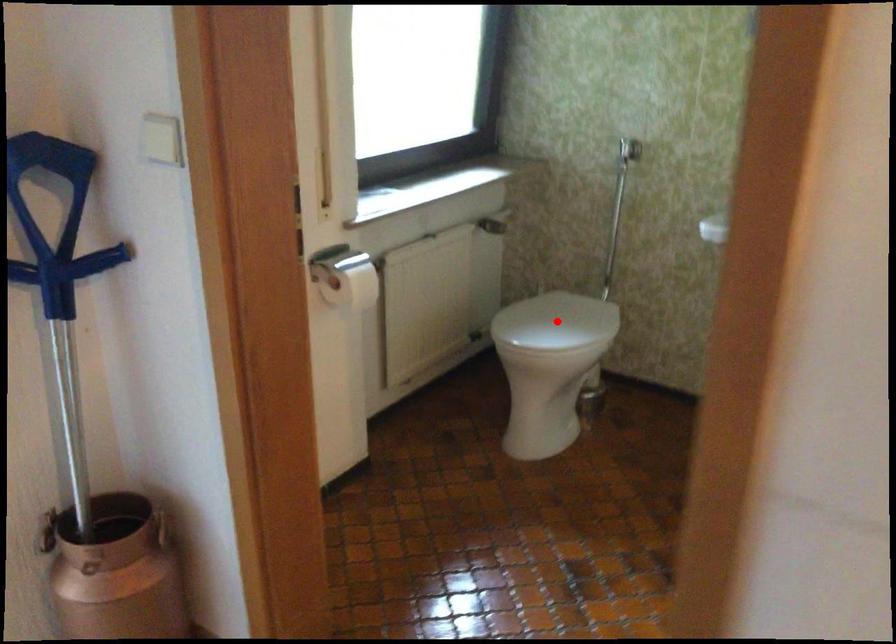
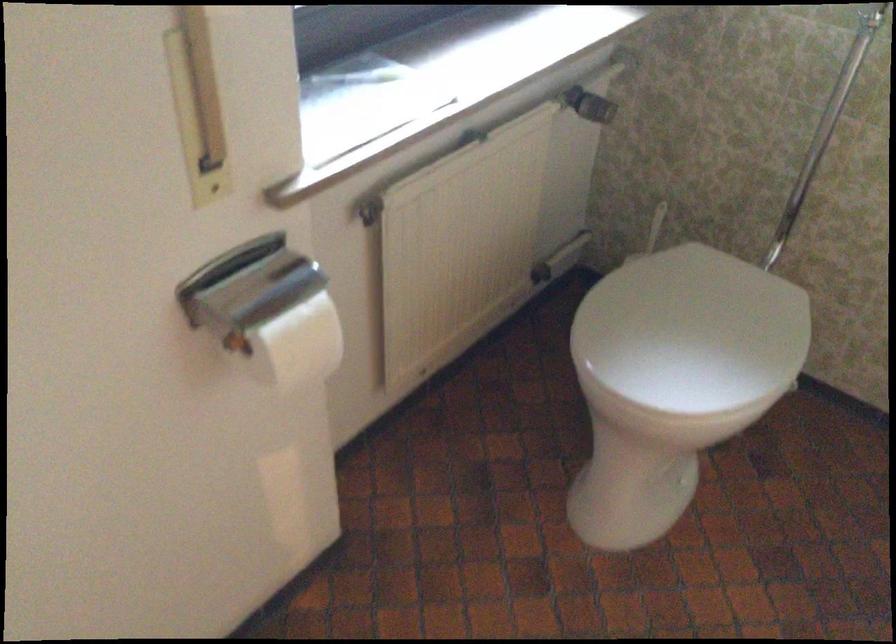
Question: A red point is marked in image1. In image2, is the corresponding 3D point closer to the camera or farther? Reply with the corresponding letter.

Choices:
 (A) The corresponding 3D point is closer.
 (B) The corresponding 3D point is farther.

Answer: (A)